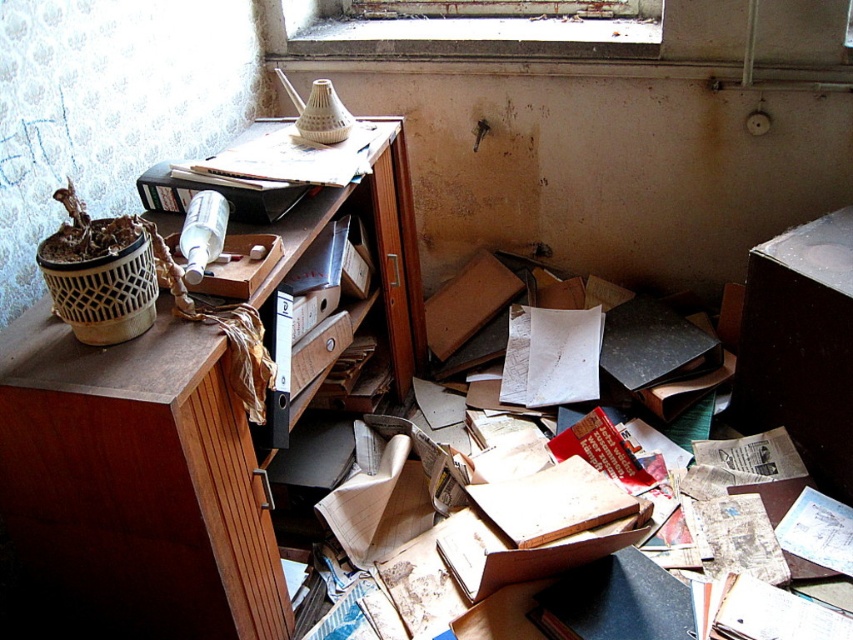
Is point (129, 452) positioned behind point (483, 51)?

No, (129, 452) is in front of (483, 51).

Between brown wood dresser at upper left and clear glass window at upper center, which one appears on the left side from the viewer's perspective?

brown wood dresser at upper left

Consider the image. Who is more forward, (36, 353) or (518, 44)?

Point (36, 353) is in front.

Find the location of a particular element. The width and height of the screenshot is (853, 640). brown wood dresser at upper left is located at coordinates (135, 484).

Does brown wood dresser at upper left appear over wooden drawer at center?

Actually, brown wood dresser at upper left is below wooden drawer at center.

Who is positioned more to the left, brown wood dresser at upper left or wooden drawer at center?

brown wood dresser at upper left

Describe the element at coordinates (135, 484) in the screenshot. This screenshot has width=853, height=640. I see `brown wood dresser at upper left` at that location.

Where is `brown wood dresser at upper left`? The width and height of the screenshot is (853, 640). brown wood dresser at upper left is located at coordinates (135, 484).

Is point (518, 20) more distant than point (306, 364)?

Yes, point (518, 20) is farther from viewer.

Can you confirm if clear glass window at upper center is thinner than wooden drawer at center?

No, clear glass window at upper center is not thinner than wooden drawer at center.

Between point (347, 10) and point (310, 330), which one is positioned in front?

Point (310, 330) is in front.

Image resolution: width=853 pixels, height=640 pixels. What are the coordinates of `clear glass window at upper center` in the screenshot? It's located at (474, 28).